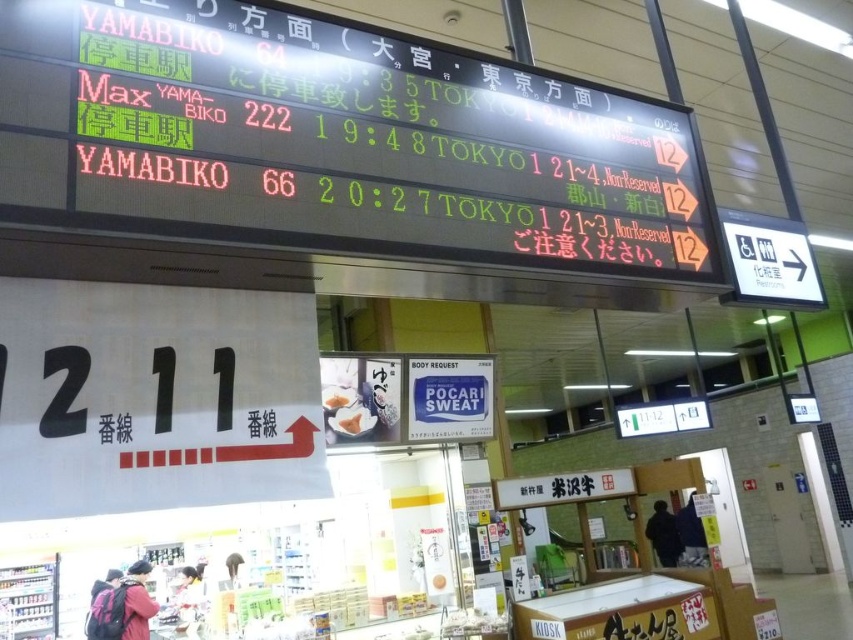
You are a traveler at the train station and want to find the led electronic board at upper center and the white matte bread at center. Which object is located to the right side from your perspective?

The led electronic board at upper center is to the right of white matte bread at center.

You are a traveler with a 1.8 meters wide luggage cart. You need to pass between the led electronic board at upper center and the blue plastic sign at center to reach the platform exit. Will your cart fit through the space between them?

The distance between the led electronic board at upper center and the blue plastic sign at center is 1.96 meters. Since your luggage cart is 1.8 meters wide, it will fit through the space as there is enough clearance.